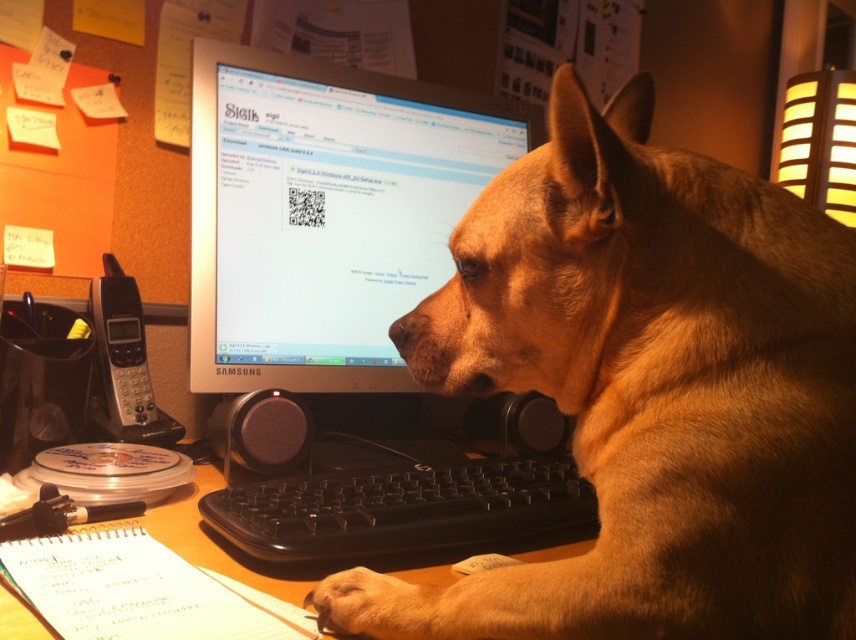
Question: Which object appears farthest from the camera in this image?

Choices:
 (A) black plastic phone at left
 (B) black plastic keyboard at center
 (C) brown fur dog at center
 (D) wooden at lower left

Answer: (A)

Question: Can you confirm if satin silver monitor at center is wider than black plastic phone at left?

Choices:
 (A) yes
 (B) no

Answer: (A)

Question: Does brown fur dog at center have a larger size compared to black plastic phone at left?

Choices:
 (A) yes
 (B) no

Answer: (A)

Question: Which of the following is the closest to the observer?

Choices:
 (A) satin silver monitor at center
 (B) black plastic phone at left

Answer: (A)

Question: From the image, what is the correct spatial relationship of brown fur dog at center in relation to satin silver monitor at center?

Choices:
 (A) above
 (B) below

Answer: (B)

Question: Which point appears farthest from the camera in this image?

Choices:
 (A) 661,323
 (B) 307,548

Answer: (B)